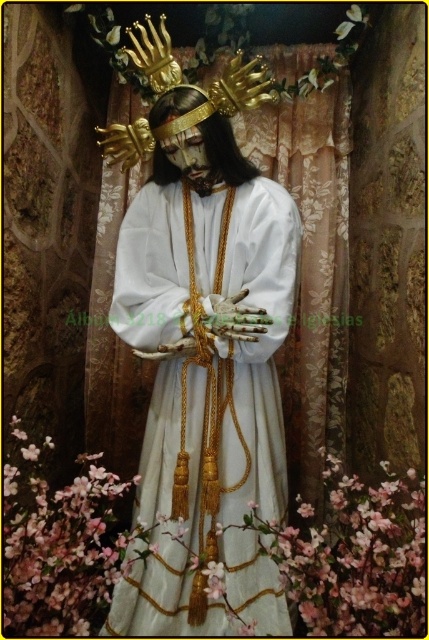
Question: Does gold metallic crown at upper center have a greater width compared to matte gold crown at center?

Choices:
 (A) yes
 (B) no

Answer: (A)

Question: Which point appears farthest from the camera in this image?

Choices:
 (A) (186, 248)
 (B) (220, 86)
 (C) (184, 92)

Answer: (A)

Question: Where is white satin dress at center located in relation to gold metallic crown at upper center in the image?

Choices:
 (A) left
 (B) right

Answer: (B)

Question: Is white satin dress at center smaller than matte gold crown at center?

Choices:
 (A) no
 (B) yes

Answer: (A)

Question: Based on their relative distances, which object is farther from the matte gold crown at center?

Choices:
 (A) gold metallic crown at upper center
 (B) white satin dress at center

Answer: (B)

Question: Which object is the farthest from the matte gold crown at center?

Choices:
 (A) white satin dress at center
 (B) gold metallic crown at upper center

Answer: (A)